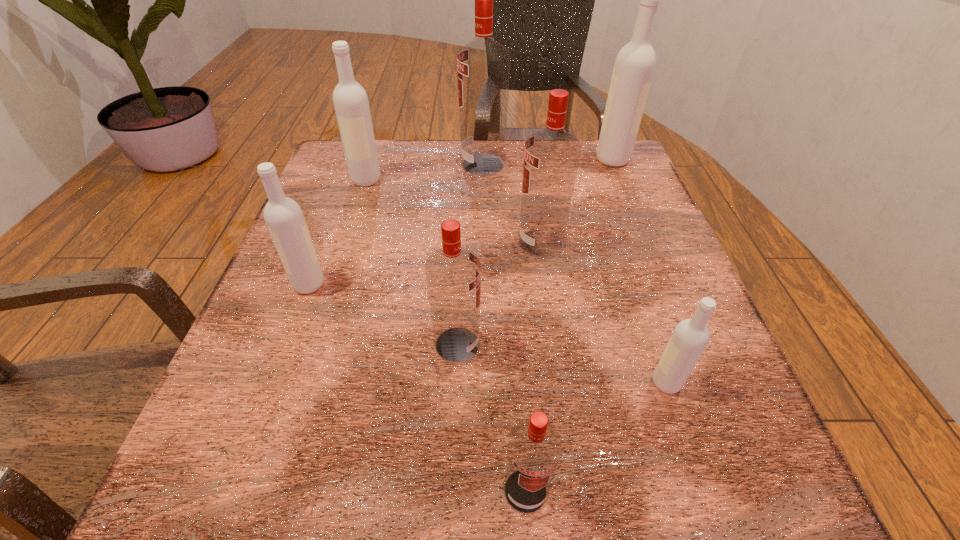
You are a GUI agent. You are given a task and a screenshot of the screen. Output one action in this format:
    pyautogui.click(x=<x>, y=<y>)
    Task: Click on the object that is the third nearest to the second nearest red vodka
    
    Given the screenshot: What is the action you would take?
    pyautogui.click(x=283, y=216)

This screenshot has width=960, height=540. Identify the location of vodka object that ranks as the fourth closest to the smallest white vodka. (283, 216).

You are a GUI agent. You are given a task and a screenshot of the screen. Output one action in this format:
    pyautogui.click(x=<x>, y=<y>)
    Task: Click on the vodka that can be found as the third closest to the smallest red vodka
    
    Given the screenshot: What is the action you would take?
    pyautogui.click(x=551, y=156)

Identify the location of red vodka that is the closest one to the farthest white vodka. Image resolution: width=960 pixels, height=540 pixels. (483, 66).

Choose which red vodka is the nearest neighbor to the third biggest white vodka. Please provide its 2D coordinates. Your answer should be formatted as a tuple, i.e. [(x, y)], where the tuple contains the x and y coordinates of a point satisfying the conditions above.

[(453, 274)]

Locate an element on the screen. The width and height of the screenshot is (960, 540). white vodka that is the closest to the smallest red vodka is located at coordinates (690, 337).

The height and width of the screenshot is (540, 960). What are the coordinates of `white vodka that can be found as the fourth closest to the fifth nearest object` in the screenshot? It's located at (283, 216).

Find the location of a particular element. free space that satisfies the following two spatial constraints: 1. on the front label of the sixth farthest vodka; 2. on the right side of the smallest white vodka is located at coordinates (456, 383).

Identify the location of free space that satisfies the following two spatial constraints: 1. on the front label of the smallest white vodka; 2. on the left side of the biggest red vodka. Image resolution: width=960 pixels, height=540 pixels. [x=485, y=383].